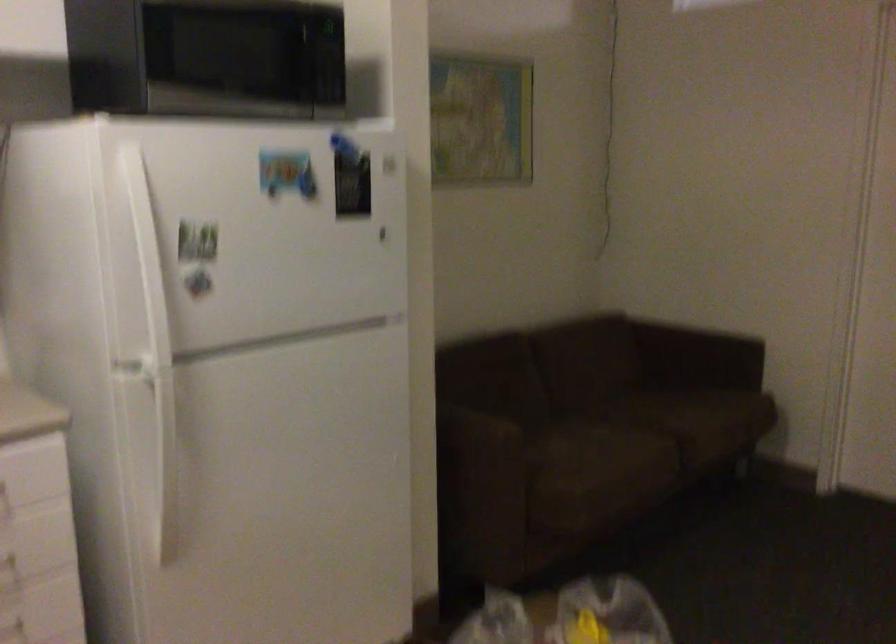
Where would you sit the sofa sitting surface? Please return your answer as a coordinate pair (x, y).

(695, 420)